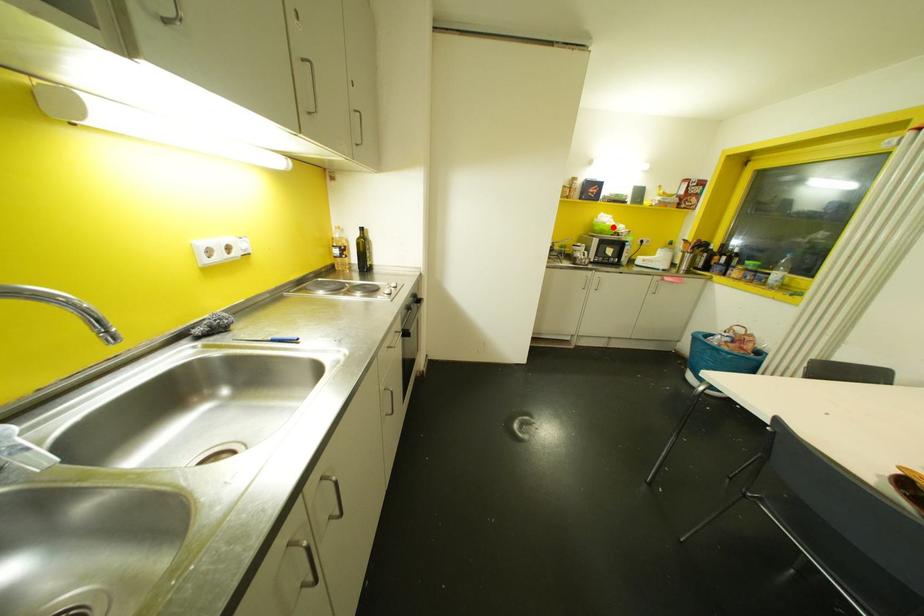
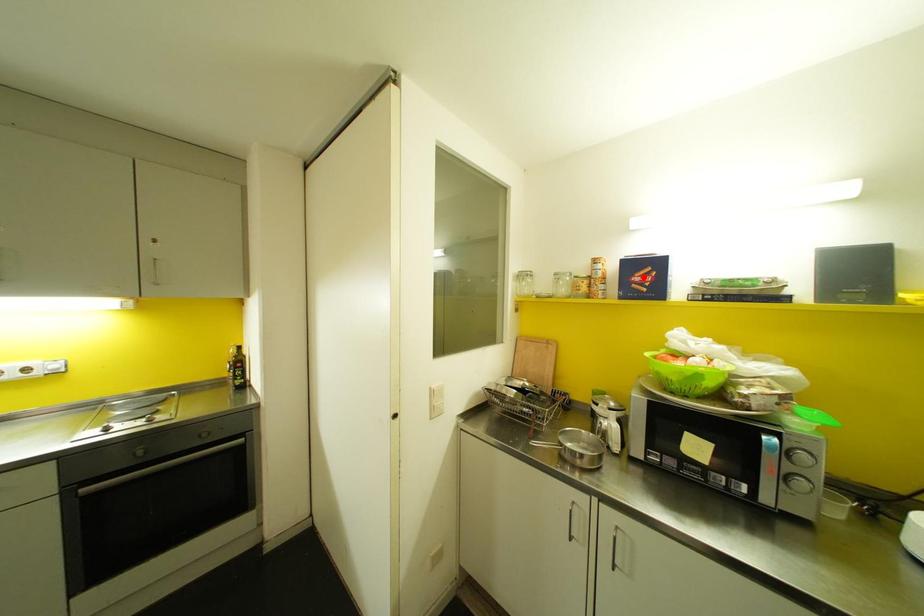
I am providing you with two images of the same scene from different viewpoints. A red point is marked on the first image and another point is marked on the second image. Is the marked point in image1 the same physical position as the marked point in image2?

No